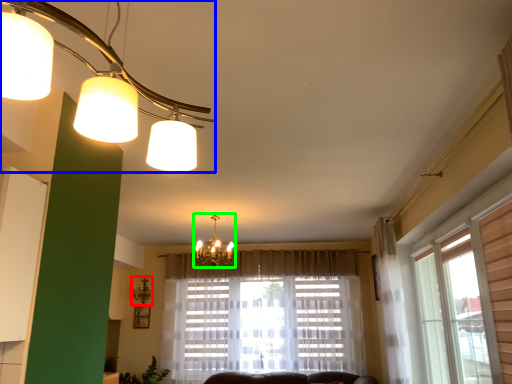
Question: Which object is positioned farthest from lamp (highlighted by a red box)? Select from lamp (highlighted by a blue box) and lamp (highlighted by a green box).

Choices:
 (A) lamp
 (B) lamp

Answer: (A)